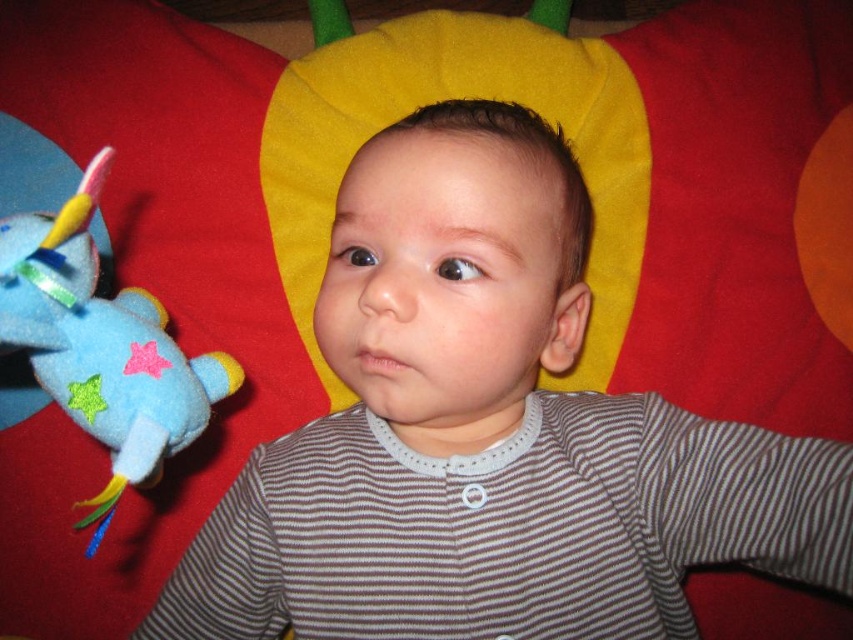
You are a photographer trying to capture the baby in the center of the image. You have a focus point at coordinate point (488, 433). Will this focus point help you capture the baby?

The point (488, 433) marks the gray striped shirt at center, so yes, focusing at that point will capture the baby as the gray striped shirt at center is part of the baby.

You are holding a camera and want to take a closeup shot of the baby in the image. The camera has a focus range of 20 inches. Is the point at coordinates point (846,493) within the focus range of your camera?

The point point (846,493) is 22.47 inches away from the camera, which is beyond the focus range of 20 inches. Therefore, the camera cannot focus on this point.